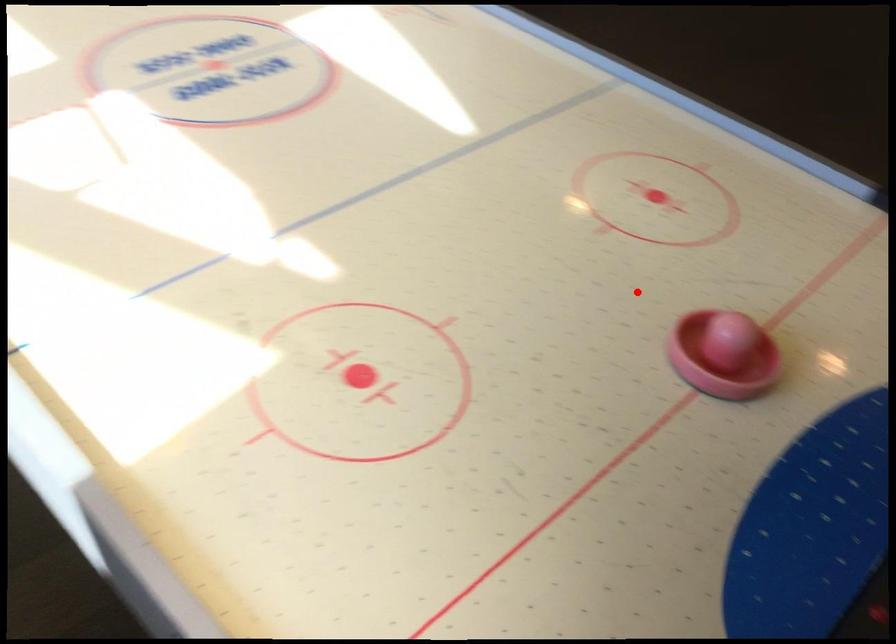
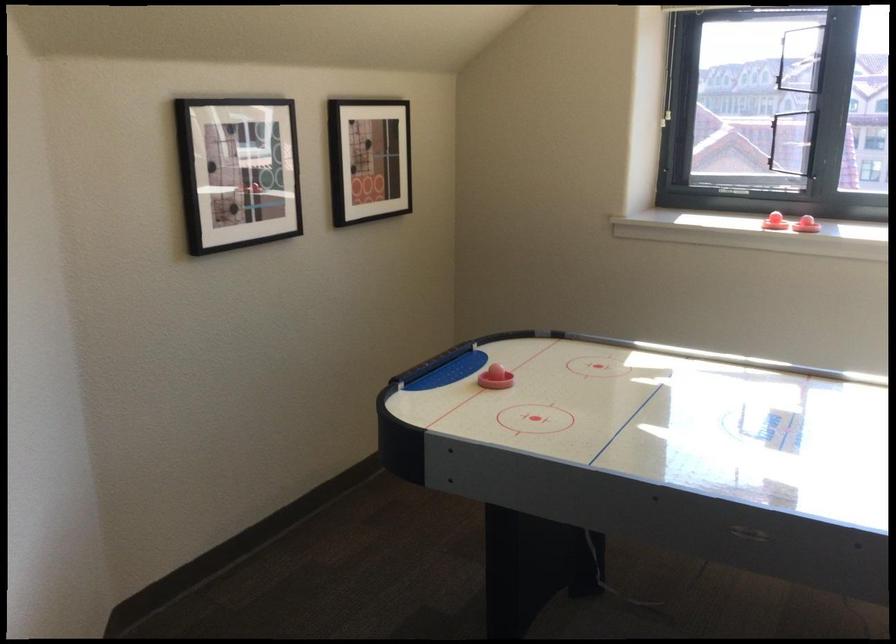
Find the pixel in the second image that matches the highlighted location in the first image.

(495, 379)